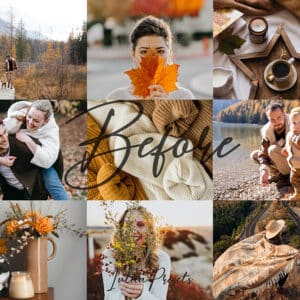
At what (x,y) coordinates should I click in order to perform the action: click on picture. Please return your answer as a coordinate pair (x, y). Looking at the image, I should click on (68, 256), (188, 222), (233, 217), (242, 121), (179, 109), (73, 129), (63, 61), (107, 60), (236, 75).